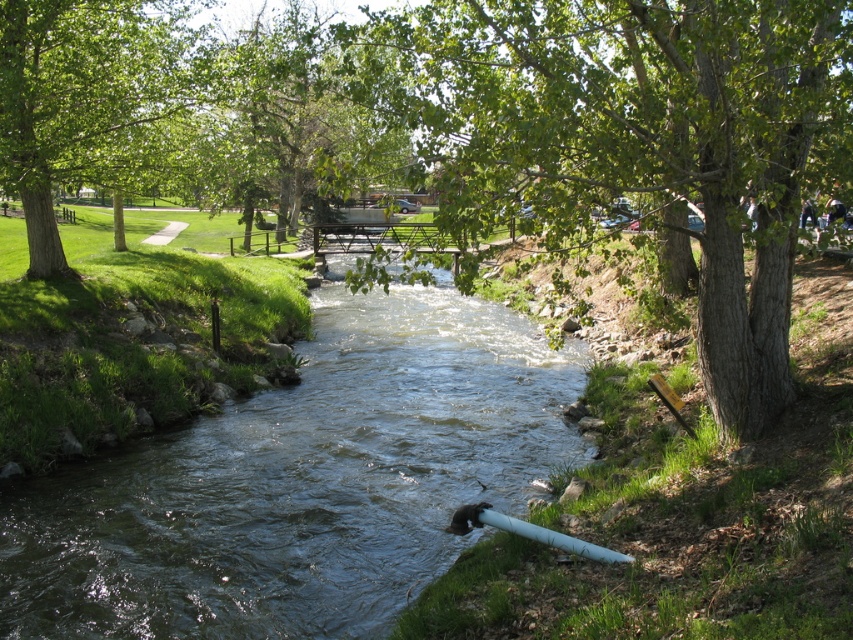
Question: Which object is the closest to the clear water at center?

Choices:
 (A) green leafy tree at upper left
 (B) green leafy tree at center

Answer: (B)

Question: Can you confirm if green leafy tree at center is bigger than green leafy tree at upper left?

Choices:
 (A) no
 (B) yes

Answer: (B)

Question: Is the position of green leafy tree at center less distant than that of green leafy tree at upper left?

Choices:
 (A) yes
 (B) no

Answer: (A)

Question: In this image, where is green leafy tree at center located relative to green leafy tree at upper left?

Choices:
 (A) left
 (B) right

Answer: (B)

Question: Which point is farther from the camera taking this photo?

Choices:
 (A) (86, 54)
 (B) (456, 330)
 (C) (575, 22)

Answer: (B)

Question: Which of the following is the closest to the observer?

Choices:
 (A) green leafy tree at upper left
 (B) clear water at center
 (C) green leafy tree at center

Answer: (C)